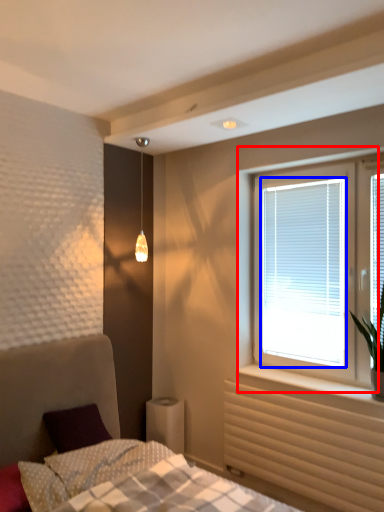
Question: Which point is further to the camera, window (highlighted by a red box) or window screen (highlighted by a blue box)?

Choices:
 (A) window
 (B) window screen

Answer: (B)